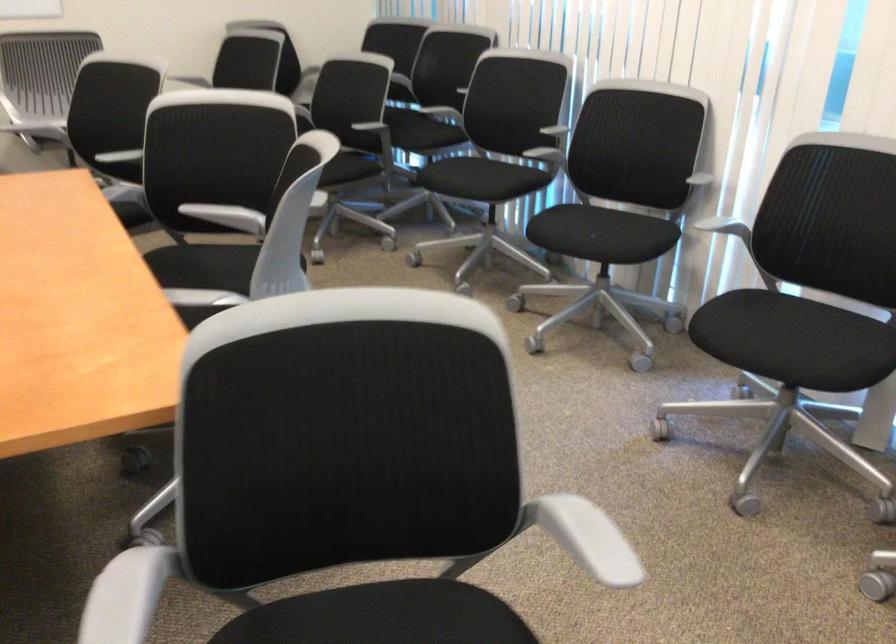
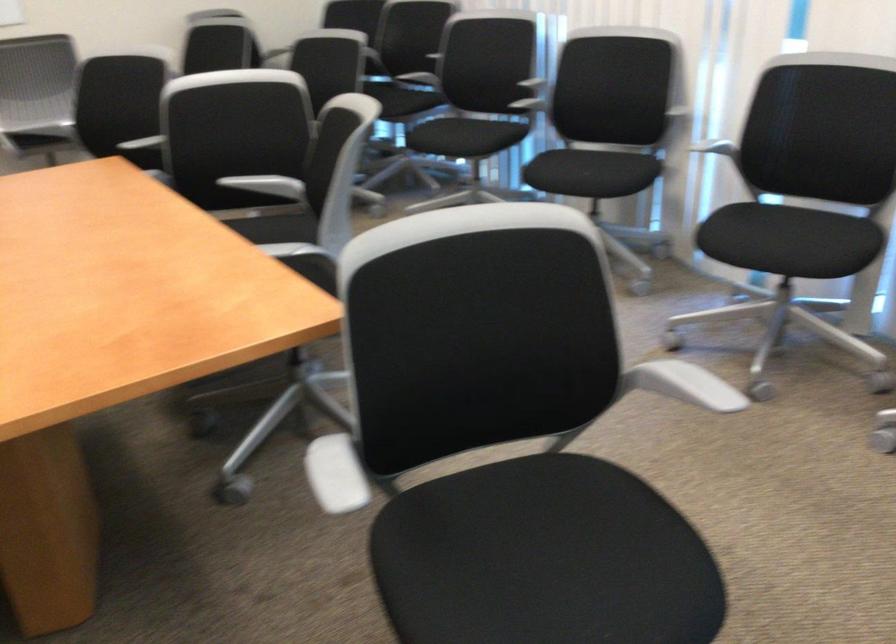
Locate, in the second image, the point that corresponds to point (236, 214) in the first image.

(268, 185)